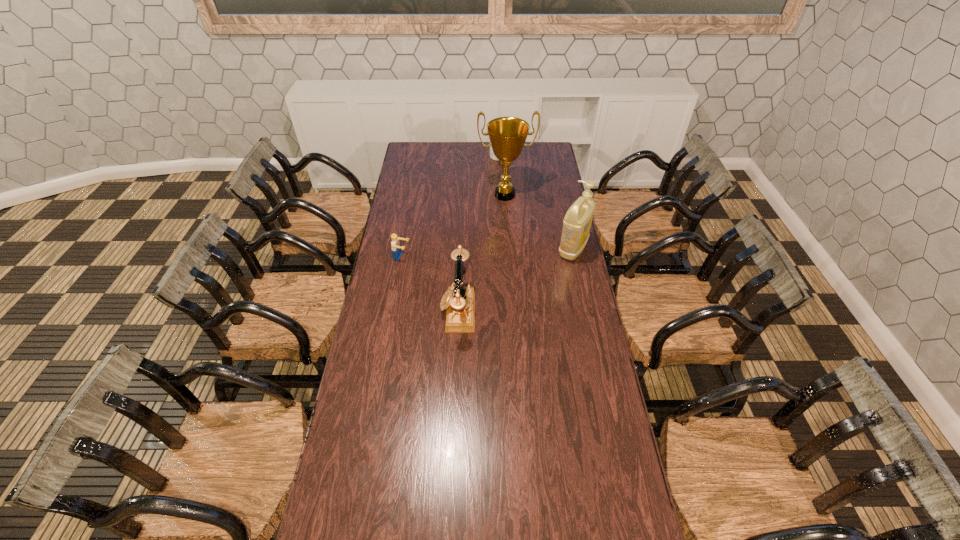
Find the location of `blank space that satisfies the following two spatial constraints: 1. on the front side of the award; 2. on the left side of the rightmost object`. blank space that satisfies the following two spatial constraints: 1. on the front side of the award; 2. on the left side of the rightmost object is located at coordinates (509, 249).